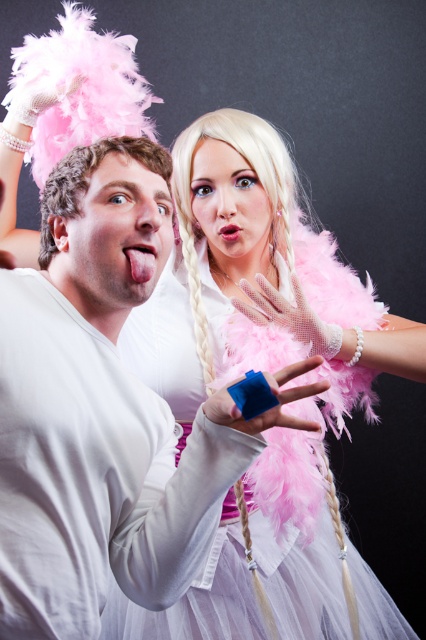
You are a photographer setting up for a photoshoot and need to position a microphone between the blonde feathered wig at upper center and the pink mesh glove at center. Based on their positions, where should you place the microphone?

The microphone should be placed below the blonde feathered wig at upper center and above the pink mesh glove at center since the blonde feathered wig at upper center is located above the pink mesh glove at center.